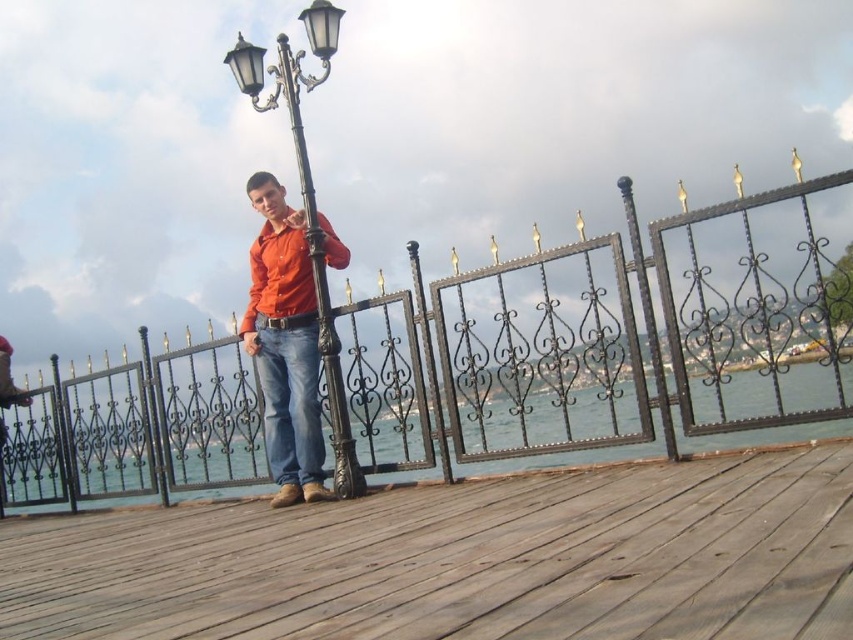
Who is positioned more to the left, weathered wood deck at center or denim at center?

Positioned to the left is denim at center.

Can you confirm if weathered wood deck at center is thinner than denim at center?

Incorrect, weathered wood deck at center's width is not less than denim at center's.

Between point (402, 516) and point (289, 355), which one is positioned behind?

Positioned behind is point (289, 355).

I want to click on weathered wood deck at center, so click(463, 561).

Which is behind, point (370, 628) or point (306, 388)?

The point (306, 388) is behind.

Which is in front, point (152, 618) or point (345, 435)?

Positioned in front is point (152, 618).

Between point (425, 618) and point (314, 396), which one is positioned in front?

Point (425, 618)

Identify the location of weathered wood deck at center. The height and width of the screenshot is (640, 853). (463, 561).

Who is shorter, polished metal lamp post at center or denim at center?

Standing shorter between the two is denim at center.

Does polished metal lamp post at center come in front of denim at center?

Yes, it is in front of denim at center.

Is point (305, 476) closer to viewer compared to point (265, 336)?

Yes, it is.

Find the location of a particular element. The image size is (853, 640). polished metal lamp post at center is located at coordinates (289, 272).